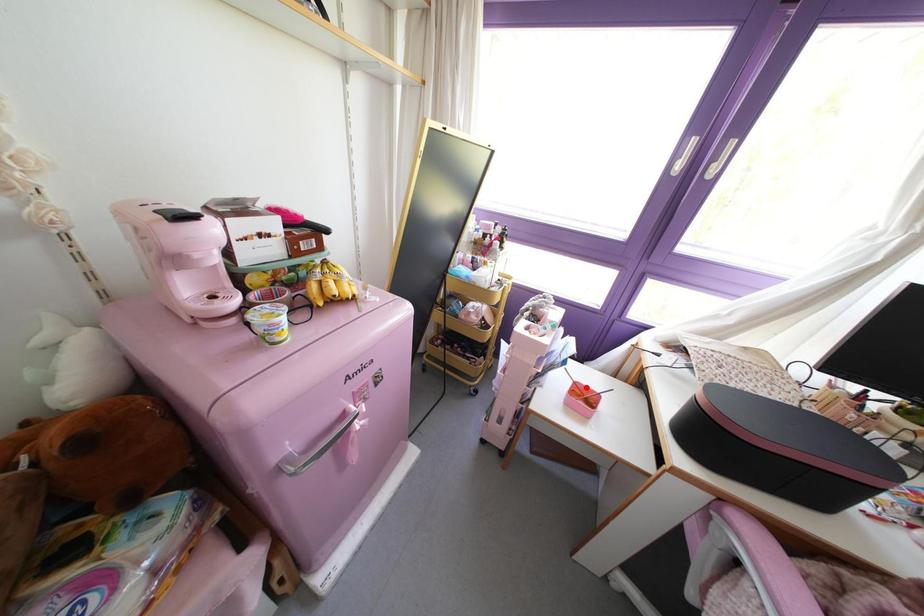
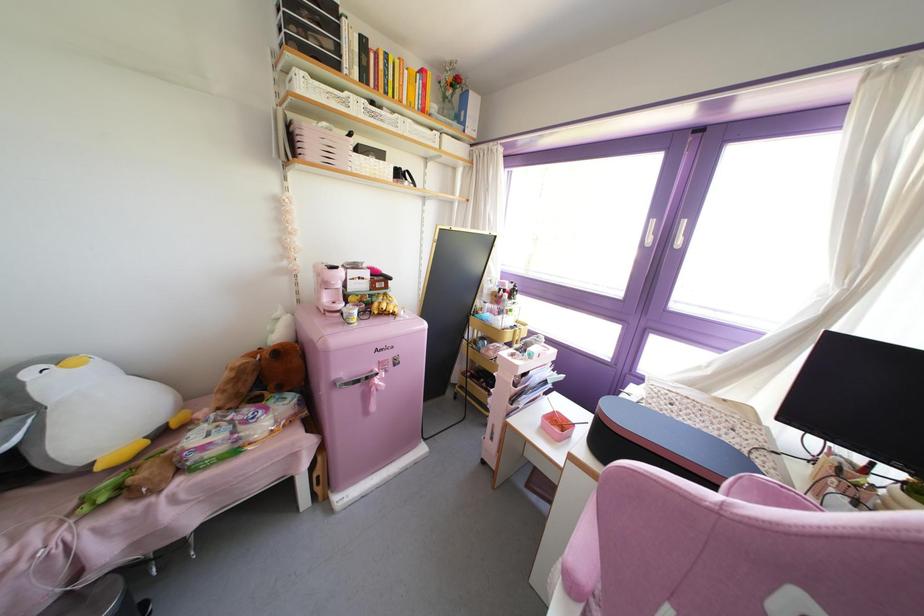
In the second image, find the point that corresponds to the highlighted location in the first image.

(565, 418)